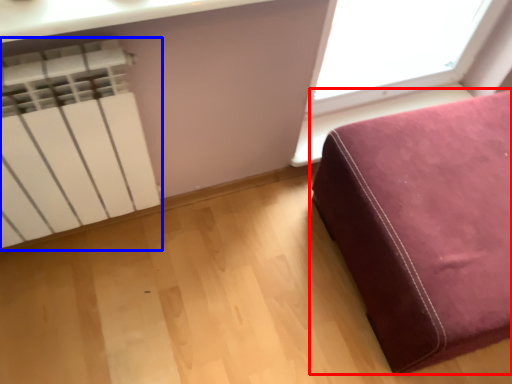
Question: Which object is further to the camera taking this photo, furniture (highlighted by a red box) or radiator (highlighted by a blue box)?

Choices:
 (A) furniture
 (B) radiator

Answer: (A)